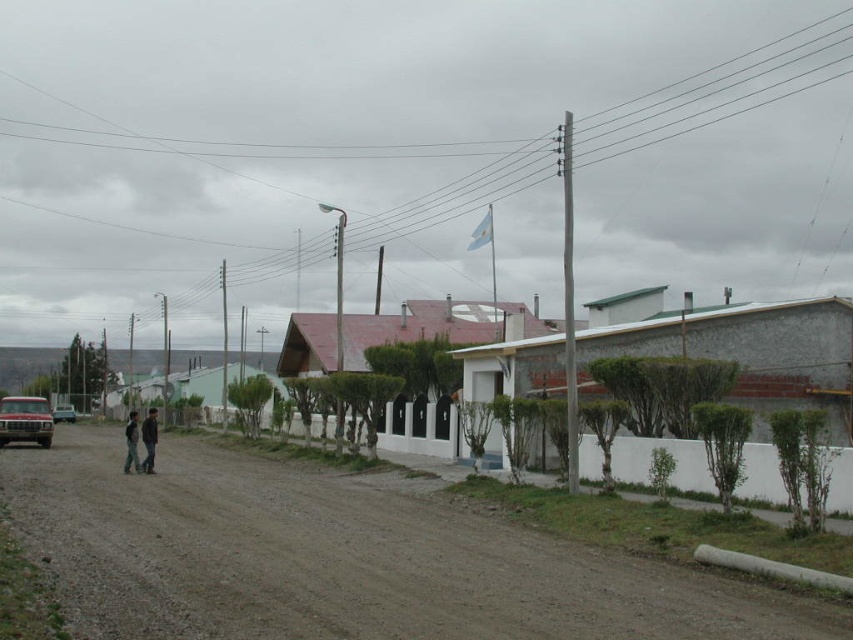
Question: Does matte silver truck at left have a greater width compared to khaki pants at center?

Choices:
 (A) yes
 (B) no

Answer: (A)

Question: Does khaki pants at center have a smaller size compared to matte red car at left?

Choices:
 (A) no
 (B) yes

Answer: (A)

Question: Which point is closer to the camera?

Choices:
 (A) white stucco houses at center
 (B) brown dirt track at center

Answer: (B)

Question: Is brown dirt track at center above dark gray jacket at center?

Choices:
 (A) yes
 (B) no

Answer: (A)

Question: Which object appears farthest from the camera in this image?

Choices:
 (A) white stucco houses at center
 (B) brown dirt track at center

Answer: (A)

Question: Among these points, which one is farthest from the camera?

Choices:
 (A) (0, 440)
 (B) (155, 429)
 (C) (848, 396)
 (D) (132, 445)

Answer: (A)